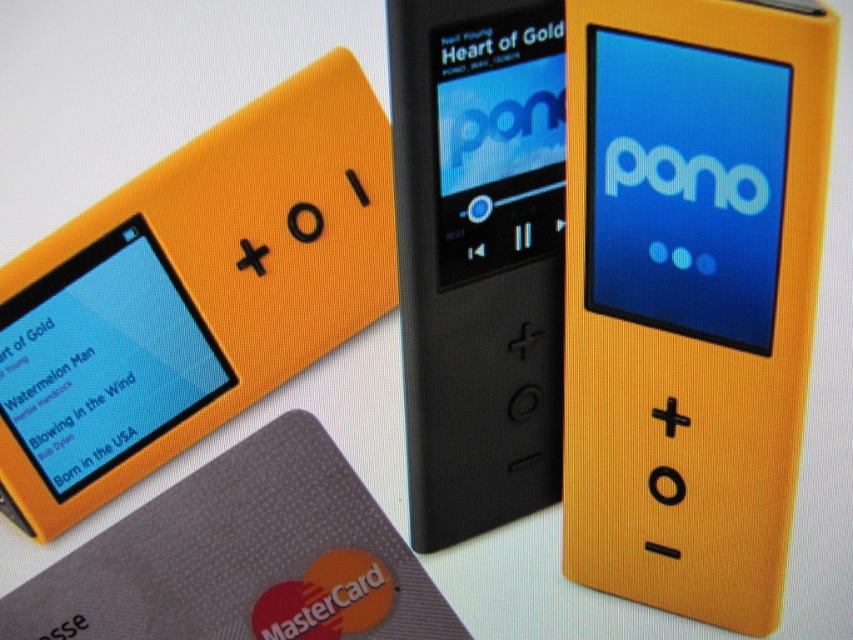
Is orange matte plastic pono at upper left smaller than black matte mp3 player at center?

No, orange matte plastic pono at upper left is not smaller than black matte mp3 player at center.

Measure the distance between orange matte plastic pono at upper left and black matte mp3 player at center.

orange matte plastic pono at upper left and black matte mp3 player at center are 24.96 centimeters apart.

Is point (273, 250) behind point (424, 115)?

Yes, it is behind point (424, 115).

You are a GUI agent. You are given a task and a screenshot of the screen. Output one action in this format:
    pyautogui.click(x=<x>, y=<y>)
    Task: Click on the orange matte plastic pono at upper left
    
    Given the screenshot: What is the action you would take?
    click(x=192, y=292)

Does orange matte ipod at center have a greater height compared to black matte mp3 player at center?

Correct, orange matte ipod at center is much taller as black matte mp3 player at center.

Between point (715, 161) and point (467, 474), which one is positioned in front?

Point (715, 161) is more forward.

Identify the location of orange matte ipod at center. This screenshot has height=640, width=853. (689, 294).

Is point (763, 323) closer to camera compared to point (91, 264)?

Yes, it is.

Between orange matte ipod at center and orange matte plastic pono at upper left, which one appears on the right side from the viewer's perspective?

orange matte ipod at center is more to the right.

Is point (657, 520) less distant than point (202, 144)?

Yes, it is.

Locate an element on the screen. This screenshot has height=640, width=853. orange matte ipod at center is located at coordinates (689, 294).